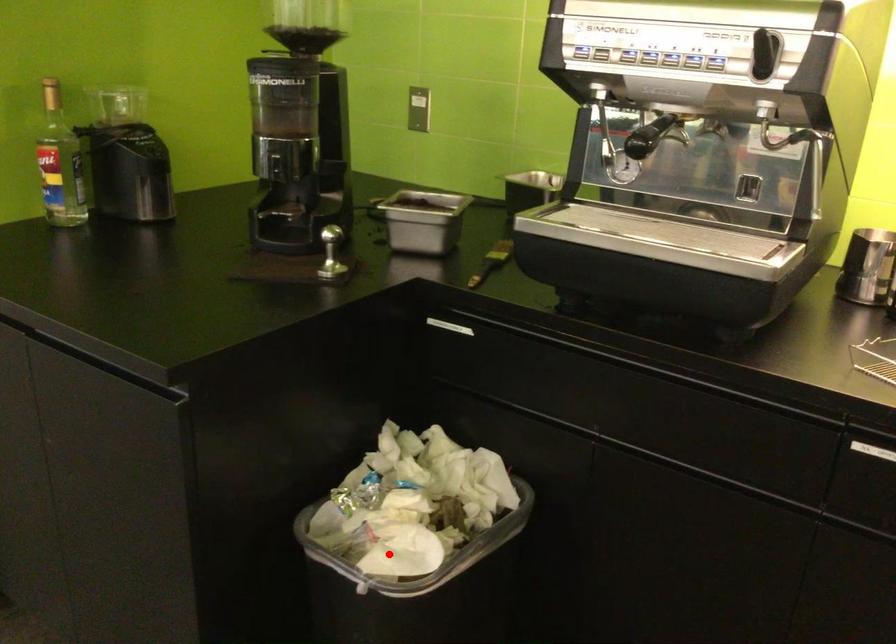
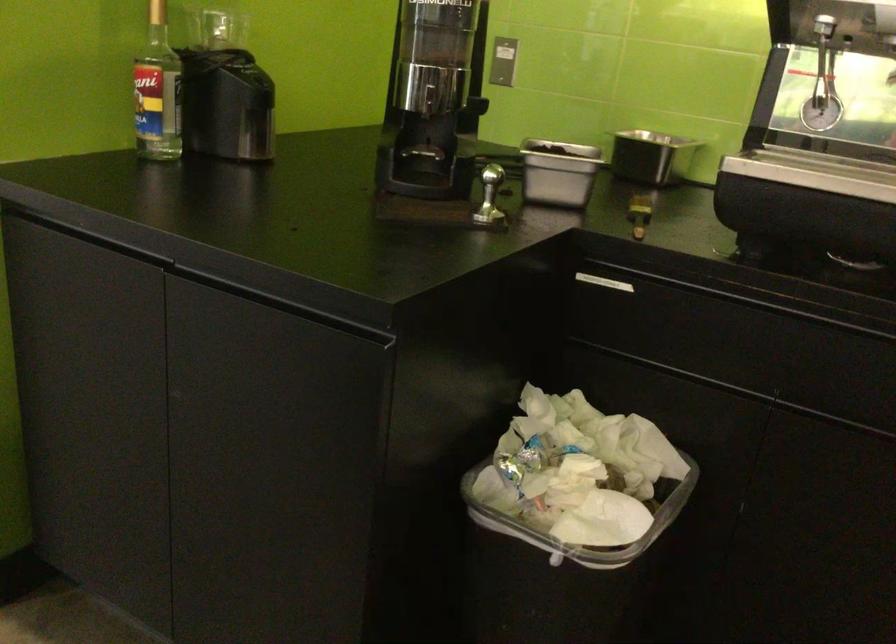
Find the pixel in the second image that matches the highlighted location in the first image.

(581, 524)